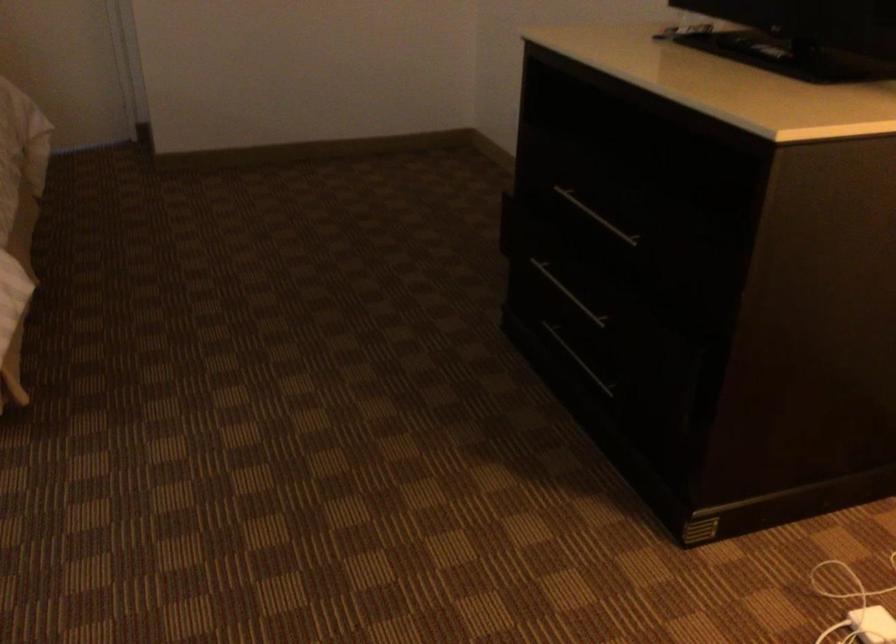
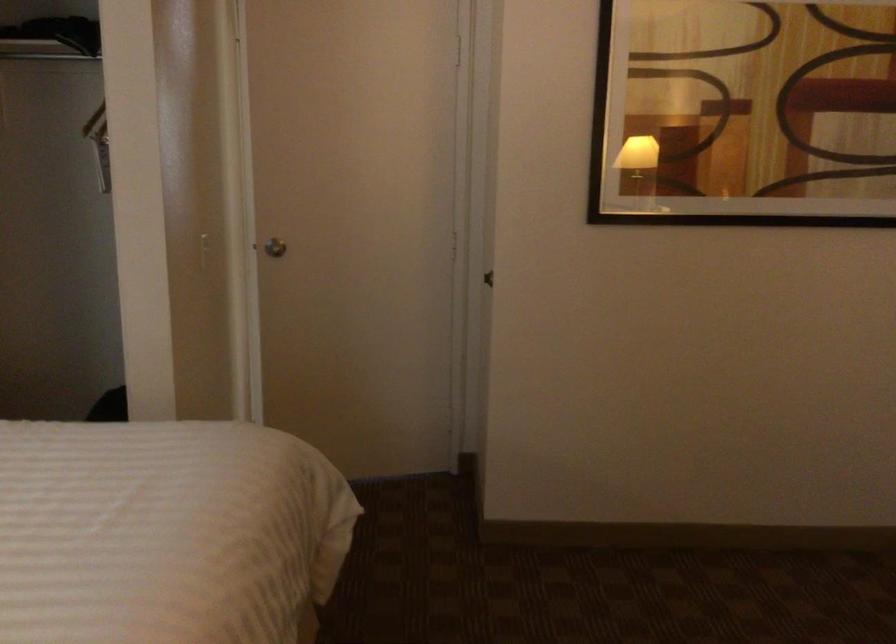
In a continuous first-person perspective shot, in which direction is the camera moving?

The movement direction of the cameraman is left, forward.